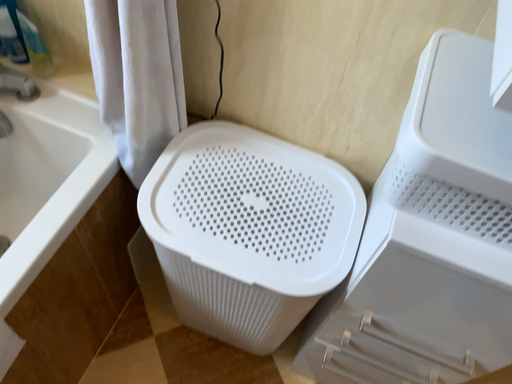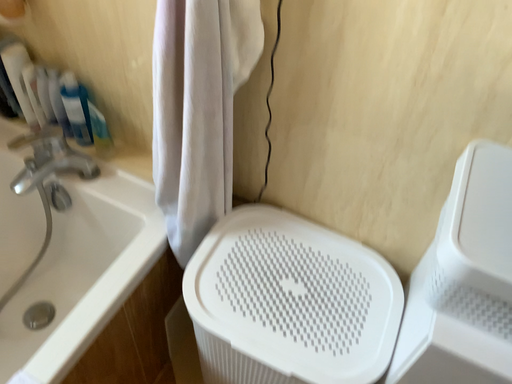
Question: Which way did the camera rotate in the video?

Choices:
 (A) rotated downward
 (B) rotated upward

Answer: (B)